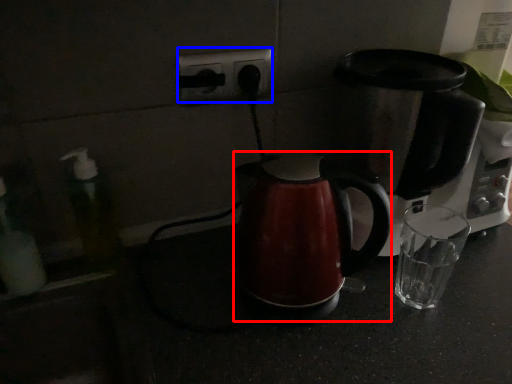
Question: Among these objects, which one is farthest to the camera, kettle (highlighted by a red box) or electric outlet (highlighted by a blue box)?

Choices:
 (A) kettle
 (B) electric outlet

Answer: (B)